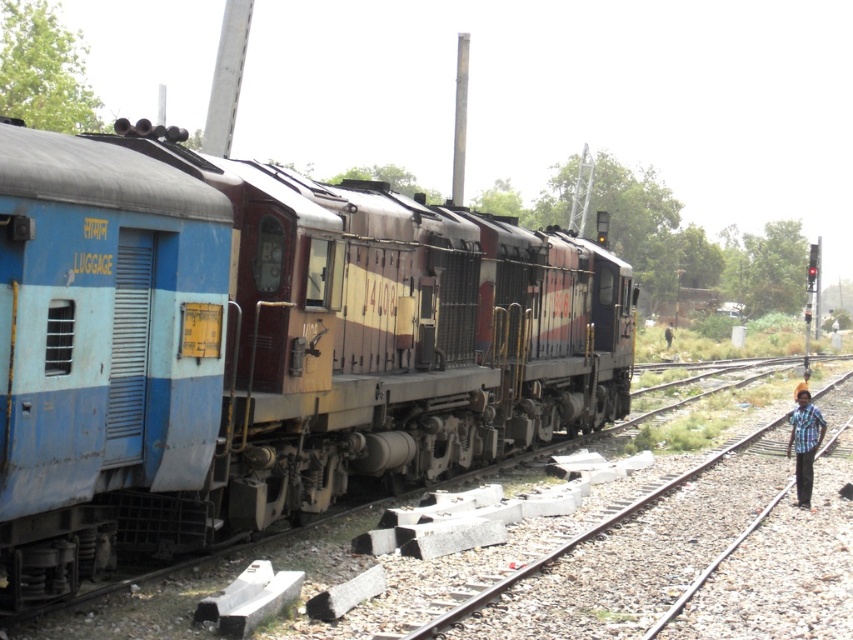
You are a photographer standing at the right side of the scene. You want to capture both the smooth metal train track at right and the blue plaid shirt at right in your photo. Which object will appear bigger in the photo?

The smooth metal train track at right will appear bigger in the photo because it is larger in size than the blue plaid shirt at right.

You are standing at the point marked by the coordinates point (263, 346) in the railway scene. What object are you standing on?

You are standing on the blue matte luggage at left marked by point (263, 346).